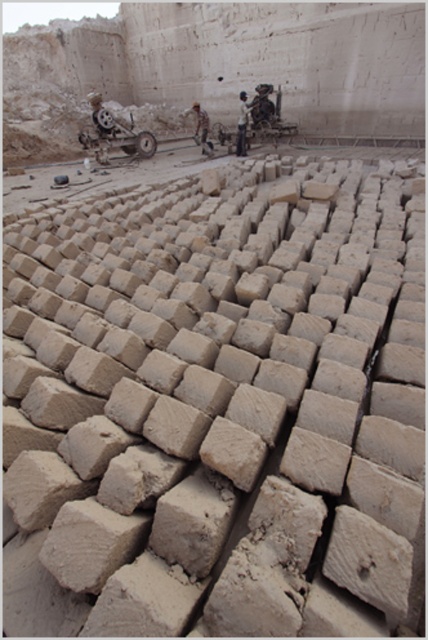
Which is above, metallic silver motorbike at upper left or light brown leather jacket at center?

light brown leather jacket at center

Looking at this image, is metallic silver motorbike at upper left shorter than light brown leather jacket at center?

Indeed, metallic silver motorbike at upper left has a lesser height compared to light brown leather jacket at center.

Which is behind, point (127, 131) or point (198, 138)?

The point (198, 138) is more distant.

Image resolution: width=428 pixels, height=640 pixels. Find the location of `metallic silver motorbike at upper left`. metallic silver motorbike at upper left is located at coordinates (113, 132).

Between point (240, 148) and point (210, 150), which one is positioned in front?

Point (240, 148) is more forward.

Who is taller, light brown clay bricks at center or light brown leather jacket at center?

light brown leather jacket at center

Is point (240, 100) positioned in front of point (196, 140)?

Yes, it is in front of point (196, 140).

Identify the location of light brown clay bricks at center. This screenshot has width=428, height=640. point(243,122).

Who is higher up, metallic silver motorbike at upper left or light brown clay bricks at center?

Positioned higher is light brown clay bricks at center.

Is point (110, 141) positioned behind point (244, 99)?

That is True.

In order to click on metallic silver motorbike at upper left in this screenshot , I will do `click(113, 132)`.